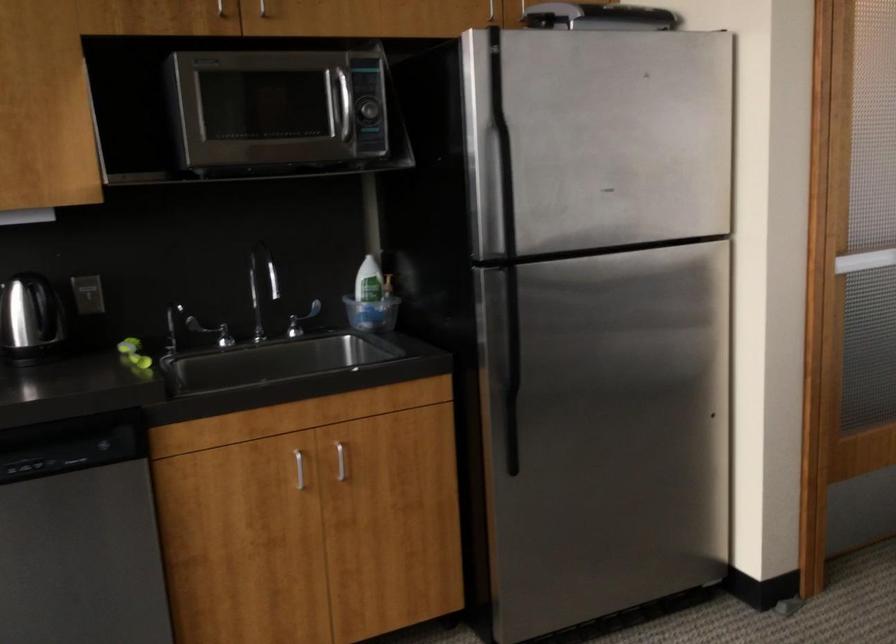
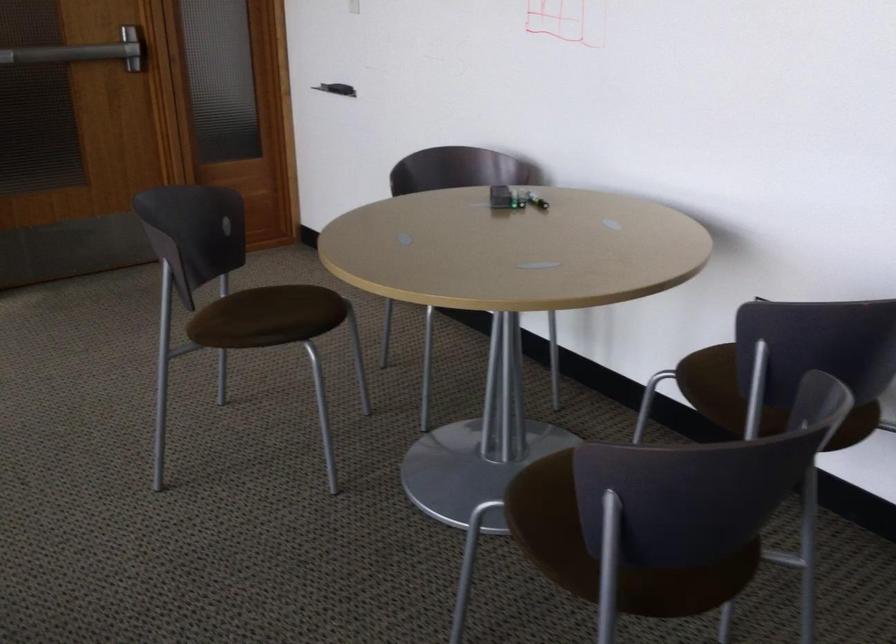
In a continuous first-person perspective shot, in which direction is the camera moving?

The cameraman walked toward right, backward.